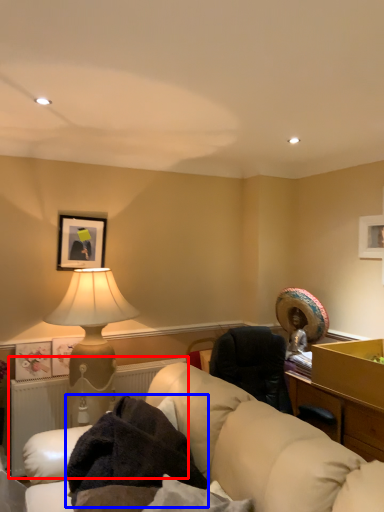
Question: Which point is further to the camera, radiator (highlighted by a red box) or blanket (highlighted by a blue box)?

Choices:
 (A) radiator
 (B) blanket

Answer: (A)